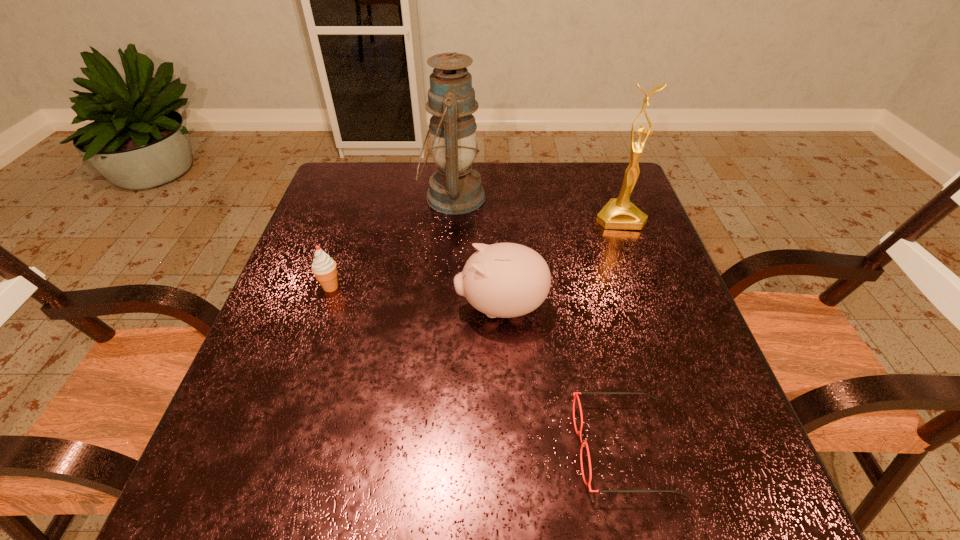
Locate an element on the screen. This screenshot has height=540, width=960. vacant space that's between the award and the oil lamp is located at coordinates (536, 207).

Locate an element on the screen. blank region between the award and the piggy bank is located at coordinates (560, 262).

What are the coordinates of `vacant space in between the leftmost object and the spectacles` in the screenshot? It's located at (478, 367).

You are a GUI agent. You are given a task and a screenshot of the screen. Output one action in this format:
    pyautogui.click(x=<x>, y=<y>)
    Task: Click on the vacant area that lies between the oil lamp and the icecream
    The width and height of the screenshot is (960, 540).
    Given the screenshot: What is the action you would take?
    pyautogui.click(x=392, y=242)

This screenshot has height=540, width=960. Identify the location of vacant area between the award and the spectacles. (622, 332).

Find the location of a particular element. Image resolution: width=960 pixels, height=540 pixels. empty space that is in between the award and the oil lamp is located at coordinates (536, 207).

In order to click on vacant space that is in between the spectacles and the piggy bank in this screenshot , I will do pos(563,377).

The width and height of the screenshot is (960, 540). Find the location of `free spot between the piggy bank and the icecream`. free spot between the piggy bank and the icecream is located at coordinates (416, 297).

I want to click on free space between the award and the oil lamp, so click(x=536, y=207).

Find the location of a particular element. Image resolution: width=960 pixels, height=540 pixels. object that stands as the closest to the piggy bank is located at coordinates (575, 394).